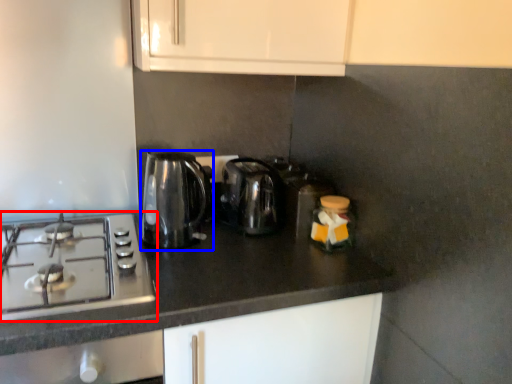
Question: Which object appears closest to the camera in this image, gas stove (highlighted by a red box) or kitchen appliance (highlighted by a blue box)?

Choices:
 (A) gas stove
 (B) kitchen appliance

Answer: (A)